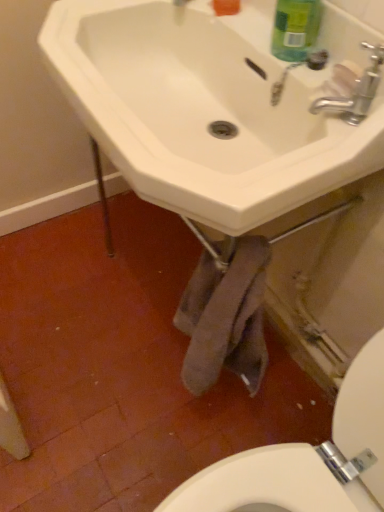
Measure the distance between point (208, 135) and camera.

Point (208, 135) is 33.54 inches from camera.

Image resolution: width=384 pixels, height=512 pixels. What do you see at coordinates (295, 29) in the screenshot?
I see `green matte bottle at upper right` at bounding box center [295, 29].

Find the location of a particular element. white ceramic sink at center is located at coordinates (217, 105).

Is white ceramic sink at center situated inside green matte bottle at upper right or outside?

white ceramic sink at center lies outside green matte bottle at upper right.

Are white ceramic sink at center and green matte bottle at upper right located far from each other?

They are positioned close to each other.

From the image's perspective, is white ceramic sink at center located above green matte bottle at upper right?

Actually, white ceramic sink at center appears below green matte bottle at upper right in the image.

Which of these two, white ceramic sink at center or green matte bottle at upper right, stands taller?

white ceramic sink at center is taller.

Considering the sizes of objects green matte bottle at upper right and white ceramic sink at center in the image provided, who is bigger, green matte bottle at upper right or white ceramic sink at center?

With larger size is white ceramic sink at center.

In the image, is green matte bottle at upper right positioned in front of or behind white ceramic sink at center?

green matte bottle at upper right is positioned farther from the viewer than white ceramic sink at center.

Is green matte bottle at upper right not near white ceramic sink at center?

green matte bottle at upper right is actually quite close to white ceramic sink at center.

Considering the sizes of objects silver metallic faucet at upper right and green matte bottle at upper right in the image provided, who is bigger, silver metallic faucet at upper right or green matte bottle at upper right?

With larger size is silver metallic faucet at upper right.

Is point (315, 105) farther from viewer compared to point (297, 35)?

No, (315, 105) is in front of (297, 35).

Could you tell me if silver metallic faucet at upper right is facing green matte bottle at upper right?

No, silver metallic faucet at upper right is not turned towards green matte bottle at upper right.

In the scene shown: Can you confirm if silver metallic faucet at upper right is positioned to the left of green matte bottle at upper right?

No.

Between silver metallic faucet at upper right and white ceramic sink at center, which one appears on the right side from the viewer's perspective?

silver metallic faucet at upper right is more to the right.

Is silver metallic faucet at upper right not close to white ceramic sink at center?

That's not correct — silver metallic faucet at upper right is a little close to white ceramic sink at center.

From the image's perspective, between silver metallic faucet at upper right and white ceramic sink at center, who is located below?

silver metallic faucet at upper right appears lower in the image.

Is point (345, 112) closer or farther from the camera than point (234, 148)?

Point (345, 112) is positioned closer to the camera compared to point (234, 148).

Identify the location of sink located in front of the silver metallic faucet at upper right. (217, 105).

Would you say white ceramic sink at center is inside or outside silver metallic faucet at upper right?

white ceramic sink at center exists outside the volume of silver metallic faucet at upper right.

Considering the points (234, 106) and (364, 88), which point is behind, point (234, 106) or point (364, 88)?

The point (234, 106) is farther from the camera.

Would you say white ceramic sink at center is a long distance from silver metallic faucet at upper right?

white ceramic sink at center is near silver metallic faucet at upper right, not far away.

From the image's perspective, is green matte bottle at upper right positioned above or below silver metallic faucet at upper right?

From the image's perspective, green matte bottle at upper right appears above silver metallic faucet at upper right.

Is point (287, 45) positioned after point (330, 106)?

Yes.

Is green matte bottle at upper right taller or shorter than silver metallic faucet at upper right?

Considering their sizes, green matte bottle at upper right has more height than silver metallic faucet at upper right.

Does green matte bottle at upper right turn towards silver metallic faucet at upper right?

No.

At what (x,y) coordinates should I click in order to perform the action: click on cleaning product located behind the white ceramic sink at center. Please return your answer as a coordinate pair (x, y). Looking at the image, I should click on (295, 29).

At what (x,y) coordinates should I click in order to perform the action: click on sink below the green matte bottle at upper right (from the image's perspective). Please return your answer as a coordinate pair (x, y). Looking at the image, I should click on (217, 105).

Which object lies nearer to the anchor point white ceramic sink at center, green matte bottle at upper right or silver metallic faucet at upper right?

green matte bottle at upper right lies closer to white ceramic sink at center than the other object.

Considering their positions, is silver metallic faucet at upper right positioned further to white ceramic sink at center than green matte bottle at upper right?

silver metallic faucet at upper right is further to white ceramic sink at center.

When comparing their distances from silver metallic faucet at upper right, does green matte bottle at upper right or white ceramic sink at center seem further?

Among the two, white ceramic sink at center is located further to silver metallic faucet at upper right.

Estimate the real-world distances between objects in this image. Which object is closer to green matte bottle at upper right, white ceramic sink at center or silver metallic faucet at upper right?

silver metallic faucet at upper right lies closer to green matte bottle at upper right than the other object.

From the image, which object appears to be nearer to silver metallic faucet at upper right, white ceramic sink at center or green matte bottle at upper right?

Based on the image, green matte bottle at upper right appears to be nearer to silver metallic faucet at upper right.

In the scene shown: Estimate the real-world distances between objects in this image. Which object is closer to green matte bottle at upper right, silver metallic faucet at upper right or white ceramic sink at center?

Among the two, silver metallic faucet at upper right is located nearer to green matte bottle at upper right.

Where is `cleaning product between white ceramic sink at center and silver metallic faucet at upper right`? cleaning product between white ceramic sink at center and silver metallic faucet at upper right is located at coordinates (295, 29).